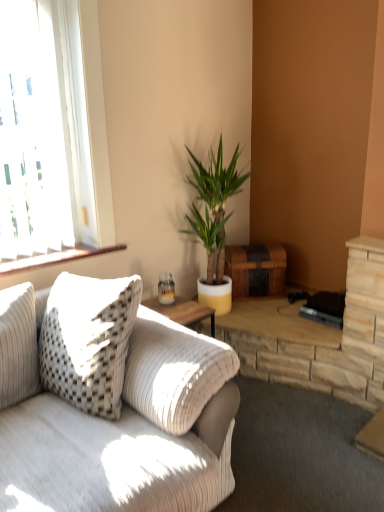
The image size is (384, 512). Find the location of `vacant location below clear glass window at upper left (from a real-world perspective)`. vacant location below clear glass window at upper left (from a real-world perspective) is located at coordinates (59, 248).